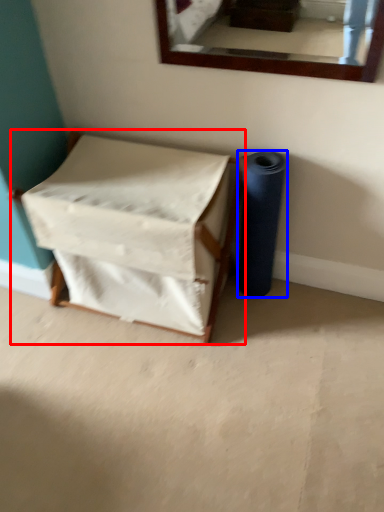
Question: Among these objects, which one is nearest to the camera, furniture (highlighted by a red box) or toilet paper (highlighted by a blue box)?

Choices:
 (A) furniture
 (B) toilet paper

Answer: (A)